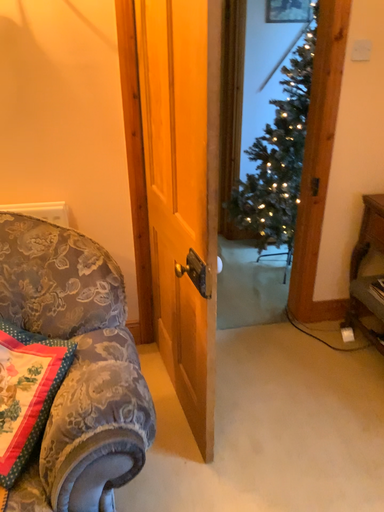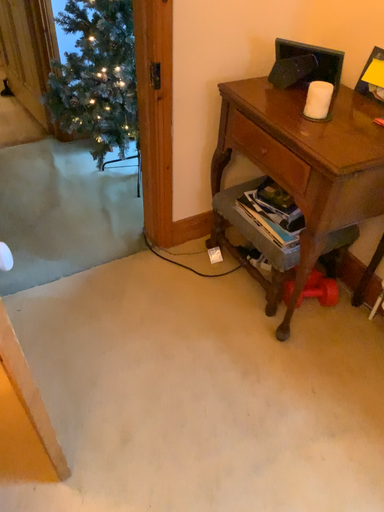
Question: How did the camera likely rotate when shooting the video?

Choices:
 (A) rotated left
 (B) rotated right

Answer: (B)